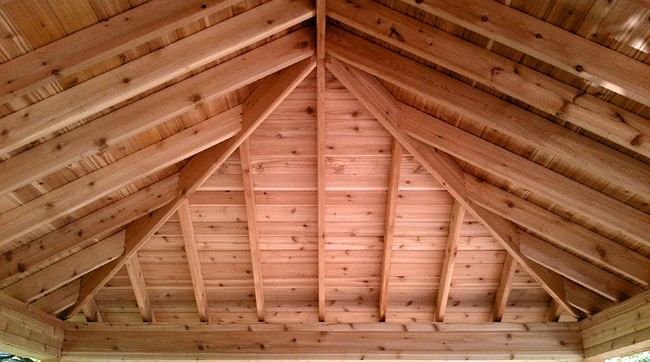
In order to click on crossbeams on left side of ceiling in this screenshot , I will do `click(106, 37)`, `click(110, 77)`, `click(127, 111)`, `click(118, 176)`, `click(121, 215)`, `click(93, 253)`, `click(66, 303)`.